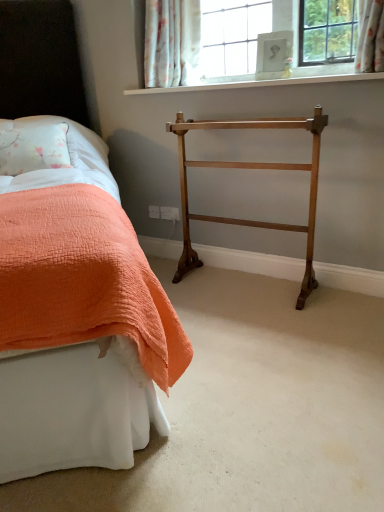
Question: From a real-world perspective, is orange quilted bed at left on top of polished brass towel rack at center?

Choices:
 (A) yes
 (B) no

Answer: (A)

Question: Is orange quilted bed at left positioned with its back to polished brass towel rack at center?

Choices:
 (A) no
 (B) yes

Answer: (A)

Question: Is orange quilted bed at left wider than polished brass towel rack at center?

Choices:
 (A) yes
 (B) no

Answer: (A)

Question: Does orange quilted bed at left have a lesser height compared to polished brass towel rack at center?

Choices:
 (A) yes
 (B) no

Answer: (B)

Question: Is orange quilted bed at left far away from polished brass towel rack at center?

Choices:
 (A) no
 (B) yes

Answer: (A)

Question: From the image's perspective, does orange quilted bed at left appear higher than polished brass towel rack at center?

Choices:
 (A) no
 (B) yes

Answer: (B)

Question: From a real-world perspective, is floral fabric curtain at upper center over polished brass towel rack at center?

Choices:
 (A) no
 (B) yes

Answer: (B)

Question: Considering the relative positions of floral fabric curtain at upper center and polished brass towel rack at center in the image provided, is floral fabric curtain at upper center to the right of polished brass towel rack at center from the viewer's perspective?

Choices:
 (A) no
 (B) yes

Answer: (A)

Question: Considering the relative sizes of floral fabric curtain at upper center and polished brass towel rack at center in the image provided, is floral fabric curtain at upper center smaller than polished brass towel rack at center?

Choices:
 (A) yes
 (B) no

Answer: (A)

Question: Does floral fabric curtain at upper center turn towards polished brass towel rack at center?

Choices:
 (A) no
 (B) yes

Answer: (A)

Question: Would you consider floral fabric curtain at upper center to be distant from polished brass towel rack at center?

Choices:
 (A) yes
 (B) no

Answer: (B)

Question: Is floral fabric curtain at upper center oriented away from polished brass towel rack at center?

Choices:
 (A) no
 (B) yes

Answer: (A)

Question: From the image's perspective, is orange quilted bed at left over white quilted fabric at left?

Choices:
 (A) yes
 (B) no

Answer: (B)